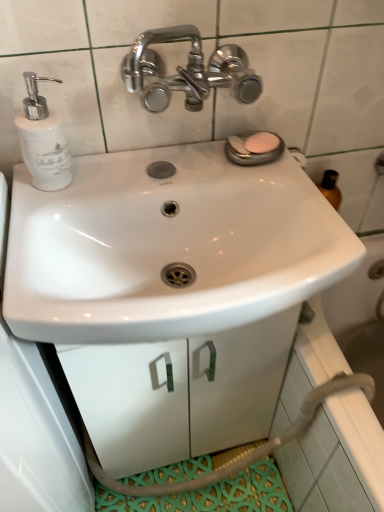
Identify the location of free location to the right of white glossy soap dispenser at left. (105, 177).